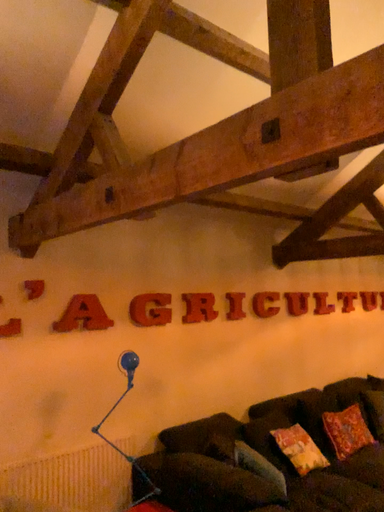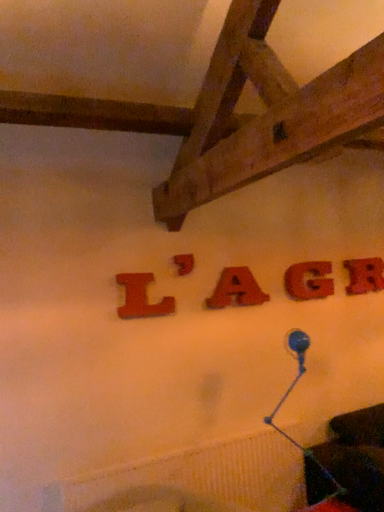
Question: Which way did the camera rotate in the video?

Choices:
 (A) rotated right
 (B) rotated left

Answer: (B)